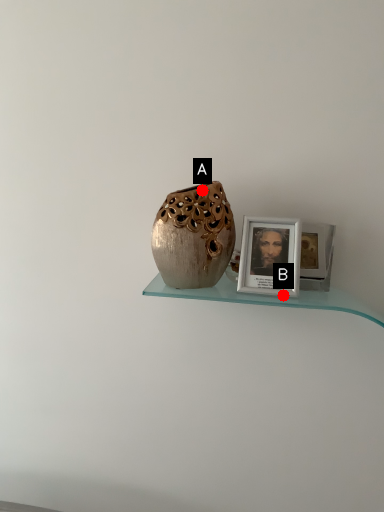
Question: Two points are circled on the image, labeled by A and B beside each circle. Among these points, which one is farthest from the camera?

Choices:
 (A) A is further
 (B) B is further

Answer: (A)